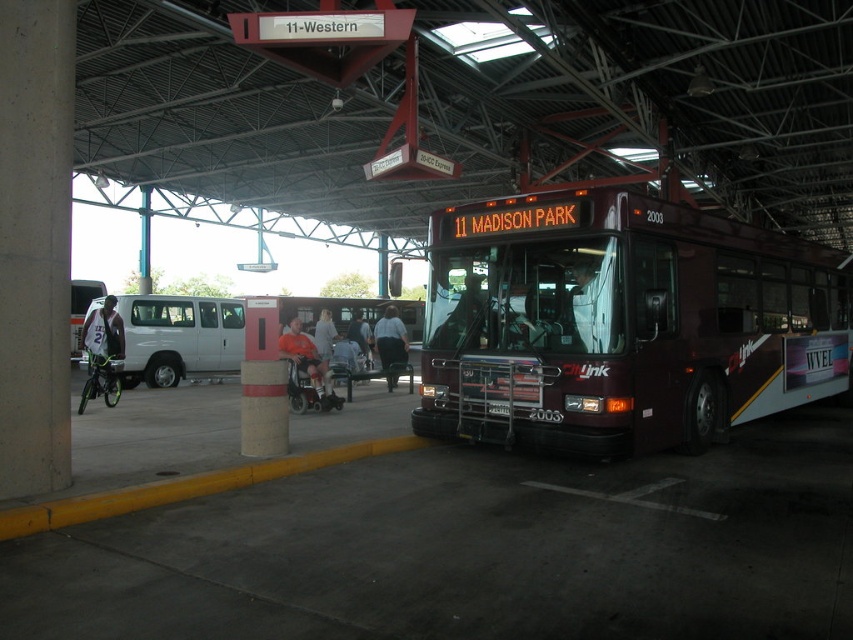
You are a bus passenger waiting at the station and see two people wearing a dark gray jacket at center and an orange shirt at center. Which person is wearing a narrower garment?

The dark gray jacket at center has a lesser width compared to the orange shirt at center, so the person wearing the dark gray jacket at center has a narrower garment.

You are a cyclist at a bus station and want to park your bicycle between the green metallic bicycle at left and the matte black bicycle at left. Which side should you place your bicycle on to ensure it fits properly?

The green metallic bicycle at left is thinner than the matte black bicycle at left, so placing your bicycle on the side of the green metallic bicycle at left would provide more space for a thinner bicycle. Alternatively, if your bicycle is wider, placing it near the matte black bicycle at left might be better.